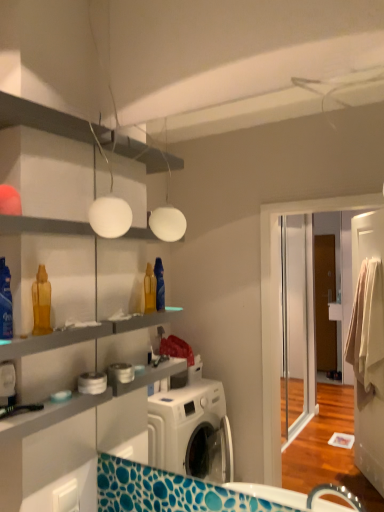
Question: Is white matte globe at upper center in front of translucent plastic bottle at left, the second cleaning product from the front?

Choices:
 (A) yes
 (B) no

Answer: (A)

Question: Is white matte globe at upper center bigger than translucent plastic bottle at left, the second cleaning product from the front?

Choices:
 (A) no
 (B) yes

Answer: (B)

Question: Is white matte globe at upper center facing towards translucent plastic bottle at left, arranged as the 2th cleaning product when viewed from the left?

Choices:
 (A) no
 (B) yes

Answer: (A)

Question: Does white matte globe at upper center have a greater width compared to translucent plastic bottle at left, the second cleaning product from the front?

Choices:
 (A) no
 (B) yes

Answer: (B)

Question: Considering the relative sizes of white matte globe at upper center and translucent plastic bottle at left, acting as the first cleaning product starting from the back, in the image provided, is white matte globe at upper center shorter than translucent plastic bottle at left, acting as the first cleaning product starting from the back,?

Choices:
 (A) no
 (B) yes

Answer: (A)

Question: Is white matte globe at upper center facing away from translucent plastic bottle at left, positioned as the 1th cleaning product in right-to-left order?

Choices:
 (A) no
 (B) yes

Answer: (A)

Question: Is translucent plastic bottle at left, positioned as the 1th cleaning product in right-to-left order, smaller than translucent plastic spray bottle at left, placed as the first cleaning product when sorted from left to right?

Choices:
 (A) yes
 (B) no

Answer: (A)

Question: Can you confirm if translucent plastic bottle at left, the second cleaning product from the front, is shorter than translucent plastic spray bottle at left, the 1th cleaning product when ordered from front to back?

Choices:
 (A) no
 (B) yes

Answer: (B)

Question: Is translucent plastic bottle at left, acting as the first cleaning product starting from the back, facing towards translucent plastic spray bottle at left, acting as the second cleaning product starting from the back?

Choices:
 (A) yes
 (B) no

Answer: (B)

Question: From the image's perspective, is translucent plastic bottle at left, positioned as the 1th cleaning product in right-to-left order, beneath translucent plastic spray bottle at left, the second cleaning product viewed from the right?

Choices:
 (A) yes
 (B) no

Answer: (A)

Question: Does translucent plastic bottle at left, positioned as the 1th cleaning product in right-to-left order, contain translucent plastic spray bottle at left, the 1th cleaning product when ordered from front to back?

Choices:
 (A) no
 (B) yes

Answer: (A)

Question: Considering the relative positions of translucent plastic bottle at left, positioned as the 1th cleaning product in right-to-left order, and translucent plastic spray bottle at left, the second cleaning product viewed from the right, in the image provided, is translucent plastic bottle at left, positioned as the 1th cleaning product in right-to-left order, to the left of translucent plastic spray bottle at left, the second cleaning product viewed from the right, from the viewer's perspective?

Choices:
 (A) no
 (B) yes

Answer: (A)

Question: Is translucent plastic bottle at left, the second cleaning product from the front, far from white matte globe at upper center?

Choices:
 (A) yes
 (B) no

Answer: (B)